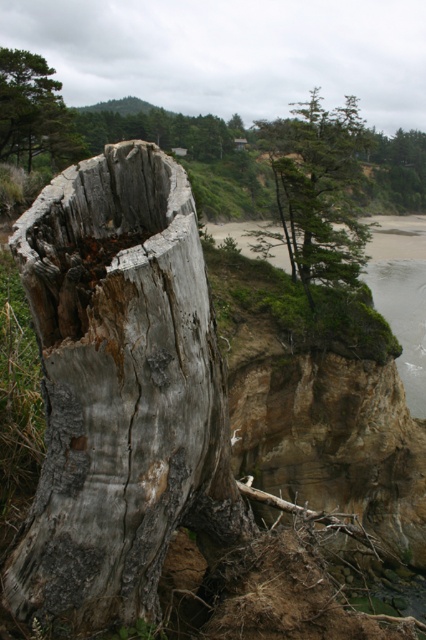
Can you confirm if green rough bark tree at upper center is smaller than green textured pine tree at upper left?

Incorrect, green rough bark tree at upper center is not smaller in size than green textured pine tree at upper left.

Does green rough bark tree at upper center have a larger size compared to green textured pine tree at upper left?

Correct, green rough bark tree at upper center is larger in size than green textured pine tree at upper left.

What are the coordinates of `green rough bark tree at upper center` in the screenshot? It's located at (319, 188).

Does weathered wood tree trunk at left appear on the left side of green textured pine tree at upper left?

Incorrect, weathered wood tree trunk at left is not on the left side of green textured pine tree at upper left.

Is the position of weathered wood tree trunk at left less distant than that of green textured pine tree at upper left?

Yes.

Is point (103, 216) positioned in front of point (54, 104)?

Yes.

The height and width of the screenshot is (640, 426). What are the coordinates of `weathered wood tree trunk at left` in the screenshot? It's located at (120, 388).

Does weathered wood tree trunk at left have a lesser height compared to green rough bark tree at upper center?

Indeed, weathered wood tree trunk at left has a lesser height compared to green rough bark tree at upper center.

Between point (169, 157) and point (345, 232), which one is positioned in front?

Point (169, 157) is more forward.

Find the location of a particular element. weathered wood tree trunk at left is located at coordinates (120, 388).